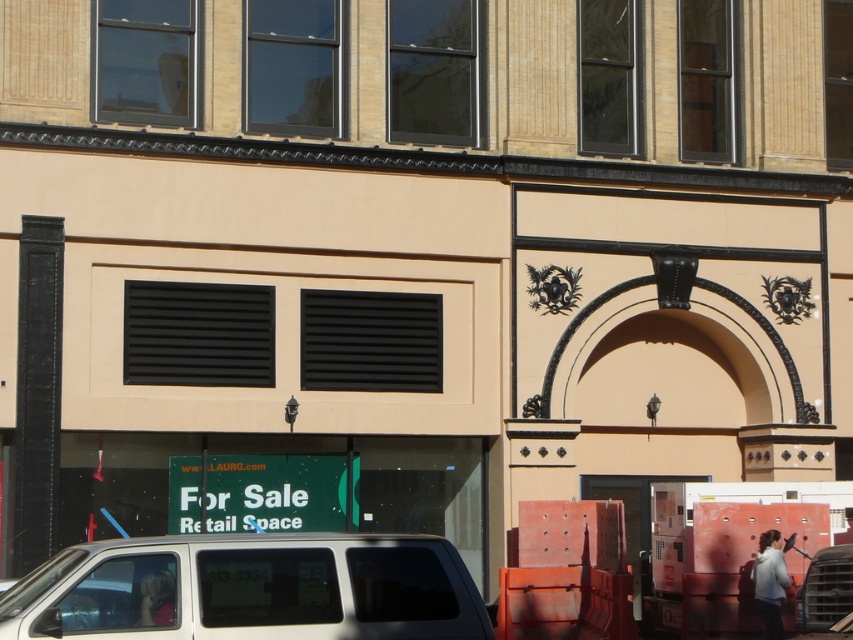
In the scene shown: You are a delivery driver approaching the building and see the white matte van at lower left and the blonde hair at lower left. Which object is nearer to you as you arrive?

The white matte van at lower left is closer to the viewer than blonde hair at lower left, so the white matte van at lower left is nearer to you.